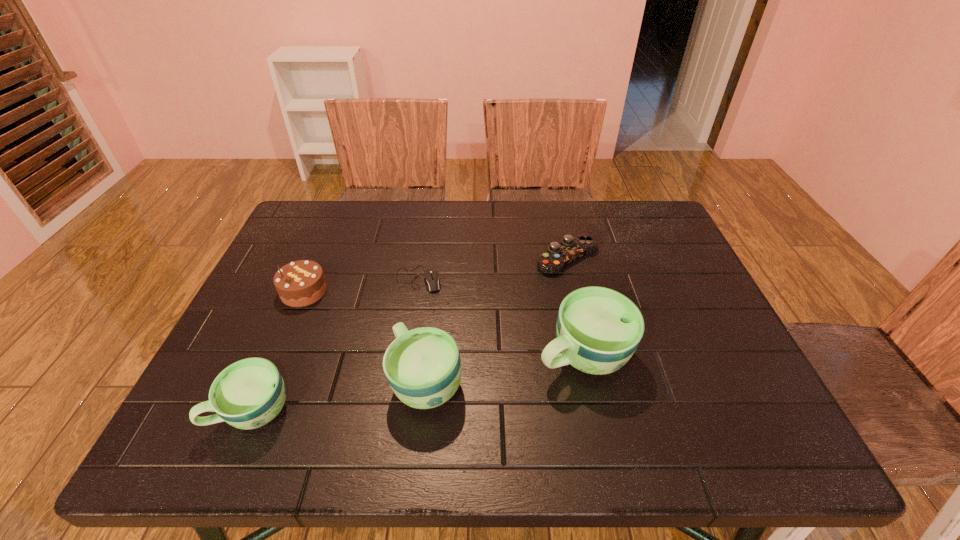
The height and width of the screenshot is (540, 960). I want to click on blank area at the far right corner, so click(x=646, y=222).

The height and width of the screenshot is (540, 960). What are the coordinates of `vacant area that lies between the shortest cup and the second tallest cup` in the screenshot? It's located at (340, 396).

You are a GUI agent. You are given a task and a screenshot of the screen. Output one action in this format:
    pyautogui.click(x=<x>, y=<y>)
    Task: Click on the vacant space that is in between the shortest object and the shortest cup
    
    Given the screenshot: What is the action you would take?
    pyautogui.click(x=336, y=345)

I want to click on blank region between the fifth tallest object and the computer mouse, so click(493, 268).

I want to click on free space that is in between the rightmost cup and the shortest object, so click(x=501, y=317).

Locate an element on the screen. Image resolution: width=960 pixels, height=540 pixels. unoccupied area between the chocolate cake and the computer mouse is located at coordinates (361, 285).

Locate an element on the screen. The width and height of the screenshot is (960, 540). empty space that is in between the shortest cup and the fifth shortest object is located at coordinates (340, 396).

You are a GUI agent. You are given a task and a screenshot of the screen. Output one action in this format:
    pyautogui.click(x=<x>, y=<y>)
    Task: Click on the object that is the fifth closest one to the chocolate cake
    Image resolution: width=960 pixels, height=540 pixels.
    Given the screenshot: What is the action you would take?
    pyautogui.click(x=571, y=248)

The image size is (960, 540). I want to click on object that is the third closest to the chocolate cake, so click(x=423, y=367).

Locate an element on the screen. cup that is the second closest to the rightmost cup is located at coordinates (248, 394).